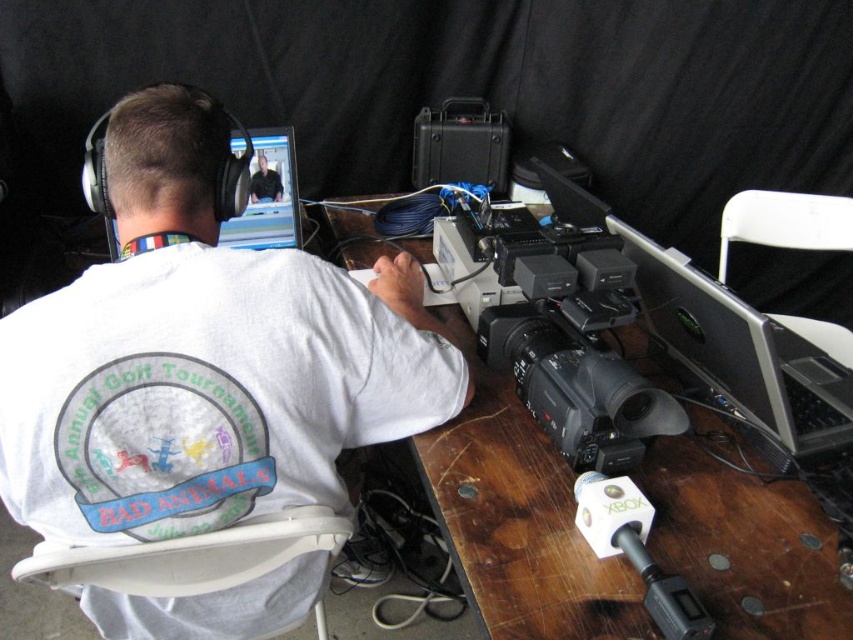
Question: Where is black plastic camera at center located in relation to matte black shirt at center in the image?

Choices:
 (A) right
 (B) left

Answer: (A)

Question: Is black plastic camera at center closer to camera compared to matte black shirt at center?

Choices:
 (A) no
 (B) yes

Answer: (B)

Question: Which object is closer to the camera taking this photo?

Choices:
 (A) matte black shirt at center
 (B) black plastic camera at center
 (C) wooden table at center
 (D) silver/black plastic computer at center-right

Answer: (C)

Question: Does wooden table at center appear on the left side of matte black shirt at center?

Choices:
 (A) yes
 (B) no

Answer: (B)

Question: Estimate the real-world distances between objects in this image. Which object is farther from the wooden table at center?

Choices:
 (A) matte black shirt at center
 (B) matte black monitor at upper center
 (C) silver/black plastic computer at center-right

Answer: (A)

Question: Estimate the real-world distances between objects in this image. Which object is farther from the matte black monitor at upper center?

Choices:
 (A) black plastic camera at center
 (B) silver/black plastic computer at center-right
 (C) white cotton shirt at center

Answer: (B)